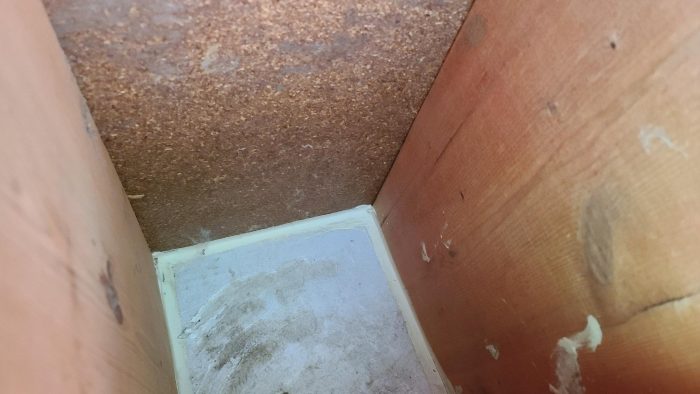
You are a GUI agent. You are given a task and a screenshot of the screen. Output one action in this format:
    pyautogui.click(x=<x>, y=<y>)
    Task: Click on the right side of wood panel
    The image size is (700, 394).
    Given the screenshot: What is the action you would take?
    pyautogui.click(x=509, y=252)